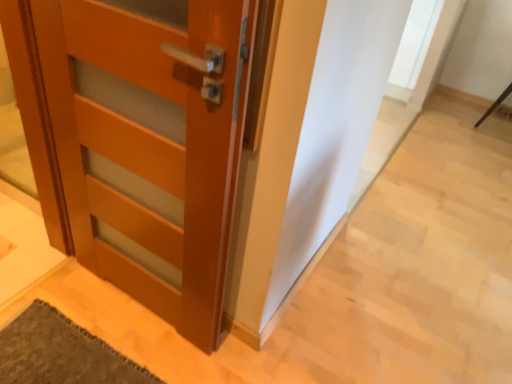
Identify the location of free point below matte wood door at left (from a real-world perspective). The image size is (512, 384). (140, 306).